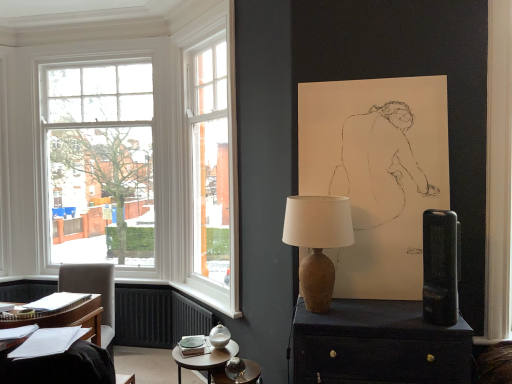
Question: Considering the relative sizes of light gray fabric chair at left and white paper at lower left in the image provided, is light gray fabric chair at left thinner than white paper at lower left?

Choices:
 (A) no
 (B) yes

Answer: (A)

Question: Does light gray fabric chair at left have a smaller size compared to white paper at lower left?

Choices:
 (A) yes
 (B) no

Answer: (B)

Question: Is light gray fabric chair at left next to white paper at lower left and touching it?

Choices:
 (A) yes
 (B) no

Answer: (B)

Question: From a real-world perspective, is light gray fabric chair at left on white paper at lower left?

Choices:
 (A) no
 (B) yes

Answer: (A)

Question: Does light gray fabric chair at left have a larger size compared to white paper at lower left?

Choices:
 (A) no
 (B) yes

Answer: (B)

Question: Is the depth of light gray fabric chair at left greater than that of white paper at lower left?

Choices:
 (A) yes
 (B) no

Answer: (A)

Question: Considering the relative sizes of black plastic speaker at right and white paper at lower left in the image provided, is black plastic speaker at right wider than white paper at lower left?

Choices:
 (A) yes
 (B) no

Answer: (B)

Question: From the image's perspective, is black plastic speaker at right on top of white paper at lower left?

Choices:
 (A) yes
 (B) no

Answer: (A)

Question: Does black plastic speaker at right turn towards white paper at lower left?

Choices:
 (A) no
 (B) yes

Answer: (A)

Question: Is black plastic speaker at right bigger than white paper at lower left?

Choices:
 (A) no
 (B) yes

Answer: (B)

Question: Are black plastic speaker at right and white paper at lower left making contact?

Choices:
 (A) yes
 (B) no

Answer: (B)

Question: Is the depth of black plastic speaker at right greater than that of white paper at lower left?

Choices:
 (A) no
 (B) yes

Answer: (B)

Question: Can you confirm if black plastic speaker at right is bigger than light gray fabric chair at left?

Choices:
 (A) yes
 (B) no

Answer: (B)